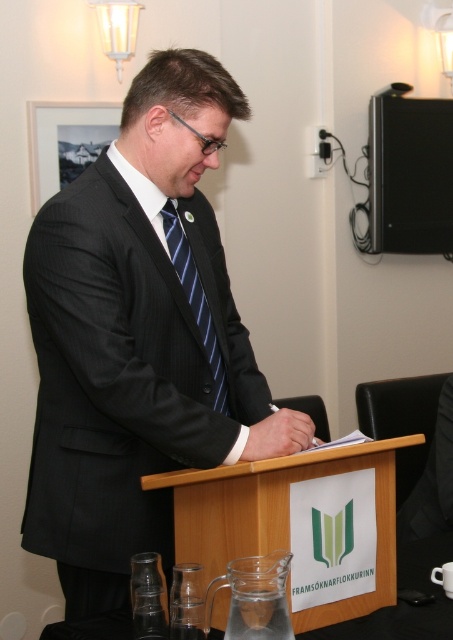
You are an event organizer who needs to adjust the lighting for a presentation. The podium requires a spotlight. Since the spotlight can only illuminate objects below it, will the spotlight placed above the black pinstripe suit at center effectively light up the wooden podium at center?

The black pinstripe suit at center is located above the wooden podium at center, so the spotlight placed above the suit will also shine down onto the podium, effectively lighting it up.

You are attending a formal event and see a man at a wooden podium. The podium has a logo with green and yellow leaves and the text FRAMS?KNARFLOKKURINN. You notice a point at coordinates (139, 337). What object does this point indicate?

The point at coordinates (139, 337) indicates the black pinstripe suit at center.

You are a fashion designer observing the man in the image. You need to determine if the black pinstripe suit at center can accommodate a wider blue striped tie at center. Based on the visual information provided, what is your conclusion?

The black pinstripe suit at center has a larger width than the blue striped tie at center, so it can accommodate a wider blue striped tie at center.